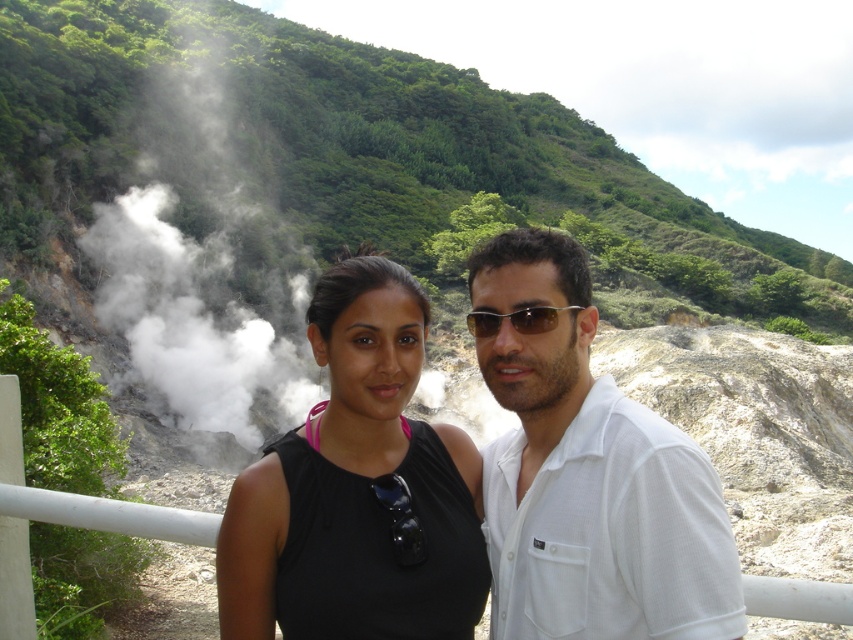
You are a photographer trying to capture a clear image of the metallic reflective sunglasses at center and the green leafy hillside at upper left. Which object should you focus on first to ensure both are in focus?

You should focus on the green leafy hillside at upper left first because the metallic reflective sunglasses at center is behind it, so adjusting focus starting from the farther object will help both be in focus.